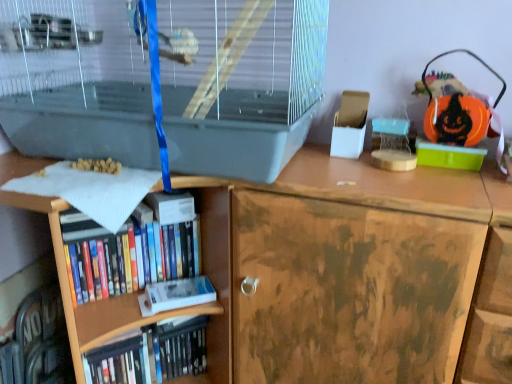
Question: Would you say white matte paperback book at lower left, acting as the 2th paperback book starting from the top, is inside or outside hardcover books at lower left, the 2th book in the bottom-to-top sequence?

Choices:
 (A) inside
 (B) outside

Answer: (B)

Question: From the image's perspective, is white matte paperback book at lower left, acting as the 2th paperback book starting from the top, above or below hardcover books at lower left, the 2th book in the bottom-to-top sequence?

Choices:
 (A) above
 (B) below

Answer: (B)

Question: Which of these objects is positioned farthest from the hardcover book at lower left, the first book ordered from the bottom?

Choices:
 (A) hardcover book at center, positioned as the second paperback book in bottom-to-top order
 (B) clear plastic birdcage at upper left
 (C) white matte paperback book at lower left, acting as the 2th paperback book starting from the top
 (D) hardcover books at lower left, which ranks as the 1th book in top-to-bottom order

Answer: (B)

Question: Considering the real-world distances, which object is closest to the hardcover book at center, the first paperback book positioned from the top?

Choices:
 (A) white matte paperback book at lower left, acting as the 2th paperback book starting from the top
 (B) hardcover book at lower left, the second book in the top-to-bottom sequence
 (C) clear plastic birdcage at upper left
 (D) hardcover books at lower left, the 2th book in the bottom-to-top sequence

Answer: (D)